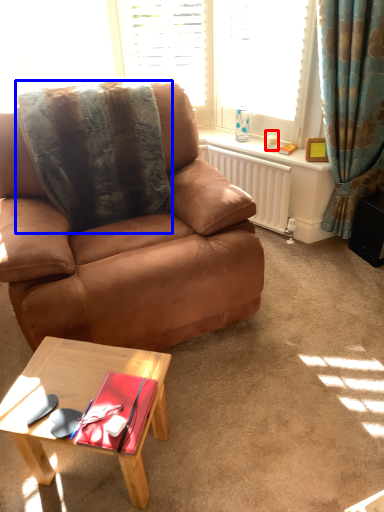
Question: Which object appears farthest to the camera in this image, coffee cup (highlighted by a red box) or blanket (highlighted by a blue box)?

Choices:
 (A) coffee cup
 (B) blanket

Answer: (A)